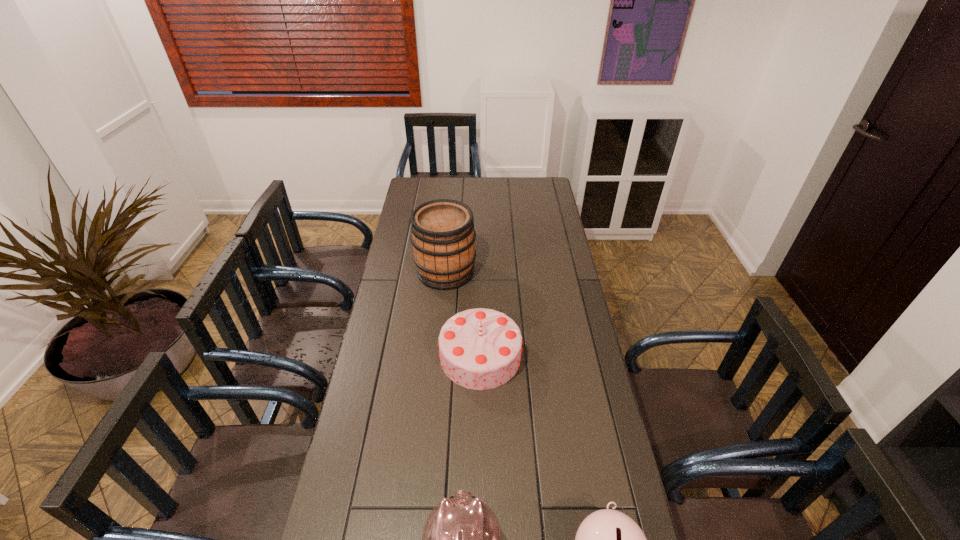
Select which object appears as the second closest to the farthest object. Please provide its 2D coordinates. Your answer should be formatted as a tuple, i.e. [(x, y)], where the tuple contains the x and y coordinates of a point satisfying the conditions above.

[(462, 539)]

Locate an element on the screen. This screenshot has height=540, width=960. the second closest object relative to the tallest object is located at coordinates (462, 539).

Identify the location of free space that satisfies the following two spatial constraints: 1. on the front side of the second farthest object; 2. on the left side of the cider. The image size is (960, 540). (438, 356).

At what (x,y) coordinates should I click in order to perform the action: click on blank space that satisfies the following two spatial constraints: 1. on the front side of the birthday cake; 2. on the right side of the farthest object. Please return your answer as a coordinate pair (x, y). Looking at the image, I should click on (438, 356).

This screenshot has height=540, width=960. In order to click on vacant space that satisfies the following two spatial constraints: 1. on the front side of the tallest object; 2. on the left side of the third nearest object in this screenshot , I will do `click(438, 356)`.